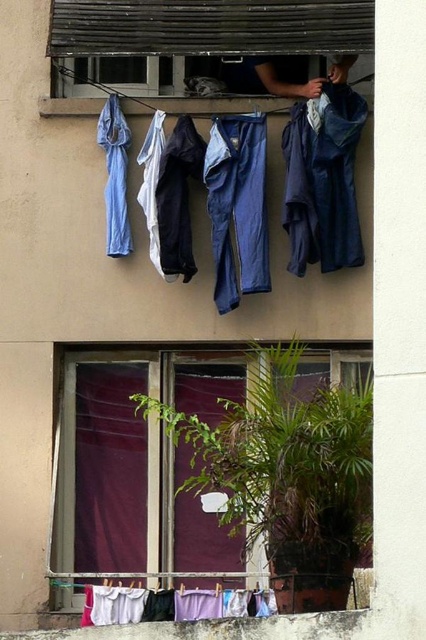
Question: Which point is closer to the camera?

Choices:
 (A) (89, 608)
 (B) (241, 284)

Answer: (A)

Question: Considering the relative positions of maroon fabric curtain at lower center and blue fabric pants at center in the image provided, where is maroon fabric curtain at lower center located with respect to blue fabric pants at center?

Choices:
 (A) left
 (B) right

Answer: (B)

Question: Which point is farther from the camera taking this photo?

Choices:
 (A) (31, 634)
 (B) (120, 118)

Answer: (B)

Question: Can you confirm if blue fabric pants at center is smaller than white cotton underwear at lower center?

Choices:
 (A) yes
 (B) no

Answer: (A)

Question: Which of these objects is positioned closest to the matte purple curtain at lower center?

Choices:
 (A) maroon fabric curtain at lower center
 (B) white cotton underwear at lower center
 (C) purple matte curtain at lower left

Answer: (A)

Question: Is maroon fabric curtain at lower center behind blue fabric pants at center?

Choices:
 (A) yes
 (B) no

Answer: (B)